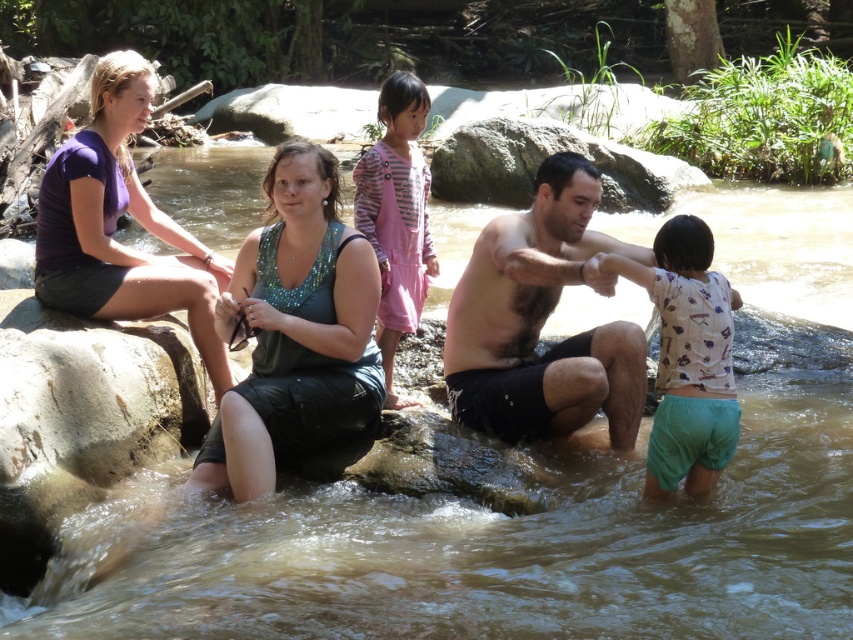
Question: Which point is farther from the camera taking this photo?

Choices:
 (A) (325, 298)
 (B) (701, 435)
 (C) (204, 356)
 (D) (418, 288)

Answer: (D)

Question: Can you confirm if white printed shirt at lower right is positioned below pink cotton dress at center?

Choices:
 (A) no
 (B) yes

Answer: (B)

Question: Considering the relative positions of green sequined tank top at center and dark skin man at center in the image provided, where is green sequined tank top at center located with respect to dark skin man at center?

Choices:
 (A) left
 (B) right

Answer: (A)

Question: Among these points, which one is nearest to the camera?

Choices:
 (A) (372, 154)
 (B) (668, 326)

Answer: (B)

Question: Which of these objects is positioned closest to the pink cotton dress at center?

Choices:
 (A) purple matte shirt at left
 (B) dark skin man at center
 (C) white printed shirt at lower right
 (D) green sequined tank top at center

Answer: (D)

Question: Where is green sequined tank top at center located in relation to pink cotton dress at center in the image?

Choices:
 (A) below
 (B) above

Answer: (A)